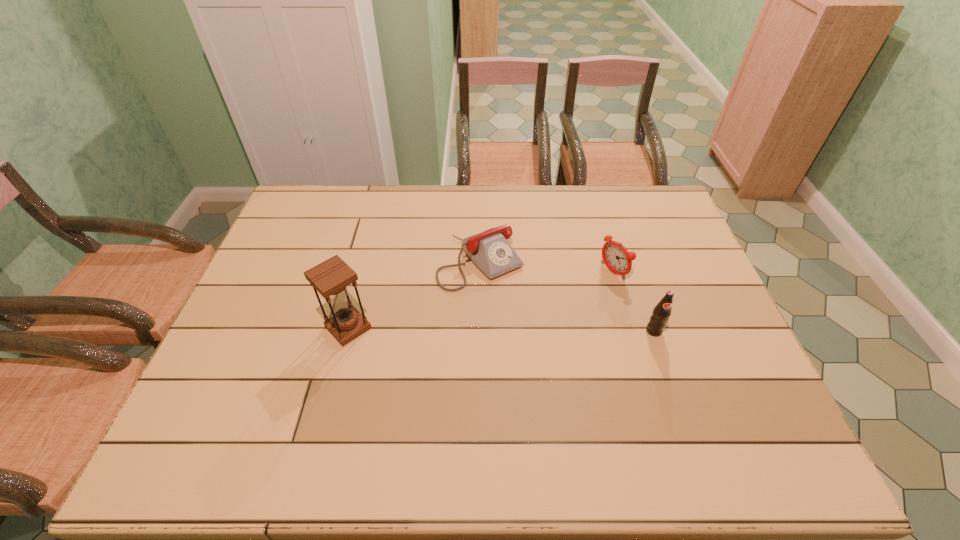
You are a GUI agent. You are given a task and a screenshot of the screen. Output one action in this format:
    pyautogui.click(x=<x>, y=<y>)
    Task: Click on the free location located 0.070m on the front-facing side of the alarm clock
    This screenshot has width=960, height=540.
    Given the screenshot: What is the action you would take?
    pyautogui.click(x=588, y=288)

The image size is (960, 540). I want to click on vacant area situated 0.120m on the front-facing side of the alarm clock, so pos(575,296).

This screenshot has width=960, height=540. What are the coordinates of `free region located 0.240m on the front-facing side of the alarm clock` in the screenshot? It's located at (543, 314).

Where is `vacant space situated on the dial of the shortest object`? Image resolution: width=960 pixels, height=540 pixels. vacant space situated on the dial of the shortest object is located at coordinates (582, 380).

Find the location of a particular element. Image resolution: width=960 pixels, height=540 pixels. free location located 0.180m on the dial of the shortest object is located at coordinates (539, 329).

This screenshot has height=540, width=960. I want to click on vacant space located on the dial of the shortest object, so click(x=592, y=393).

You are a GUI agent. You are given a task and a screenshot of the screen. Output one action in this format:
    pyautogui.click(x=<x>, y=<y>)
    Task: Click on the vacant space at the far edge of the desktop
    
    Given the screenshot: What is the action you would take?
    pyautogui.click(x=340, y=225)

This screenshot has height=540, width=960. Find the location of `vacant space at the near edge of the desktop`. vacant space at the near edge of the desktop is located at coordinates (553, 393).

You are a GUI agent. You are given a task and a screenshot of the screen. Output one action in this format:
    pyautogui.click(x=<x>, y=<y>)
    Task: Click on the free space at the right edge of the desktop
    This screenshot has width=960, height=540.
    Given the screenshot: What is the action you would take?
    pyautogui.click(x=680, y=292)

Locate an element on the screen. vacant space at the far left corner of the desktop is located at coordinates (301, 186).